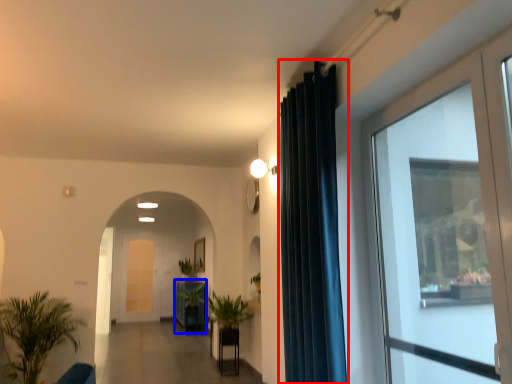
Question: Which object appears closest to the camera in this image, curtain (highlighted by a red box) or furniture (highlighted by a blue box)?

Choices:
 (A) curtain
 (B) furniture

Answer: (A)